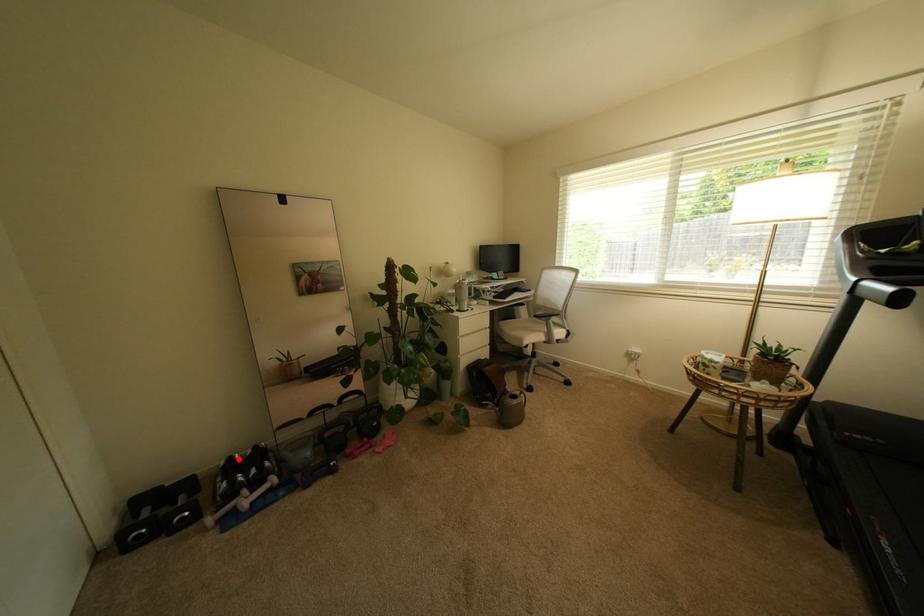
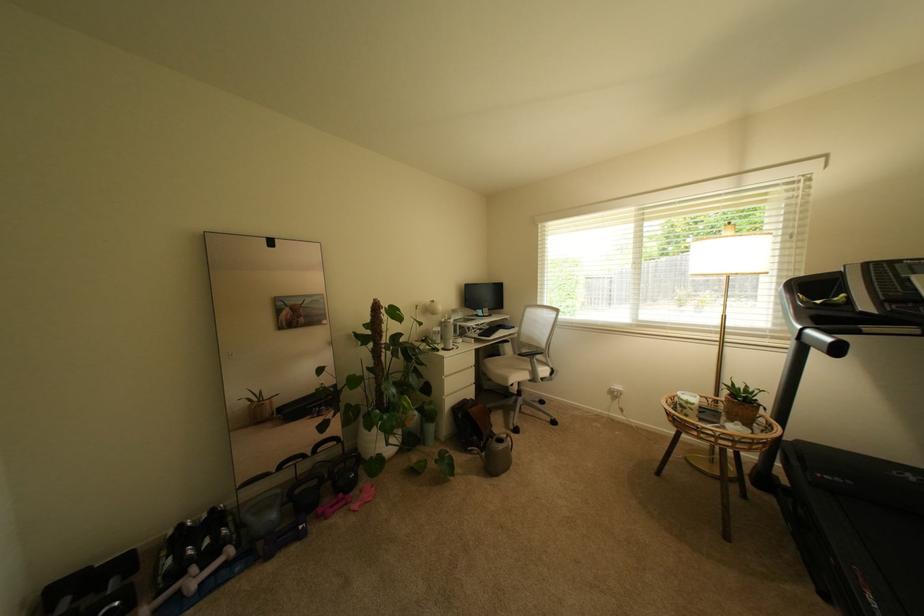
Locate, in the second image, the point that corresponds to the highlighted location in the first image.

(188, 527)